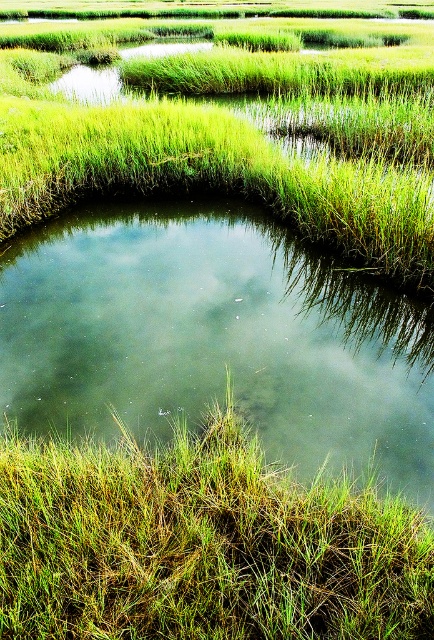
You are standing at the green grassy at lower left and want to reach the green grassy pond at center. Which direction should you move to get there?

You should move to the right to reach the green grassy pond at center from the green grassy at lower left because the green grassy pond at center is located to the right of green grassy at lower left.

You are a drone operator trying to capture aerial footage of the wetland. Your drone is currently at the coordinates given for the green grassy pond at center. To ensure safety, you need to stay above the water. Are you currently positioned over water?

The green grassy pond at center is located at coordinates point (216, 339), so yes, you are positioned over water.

You are standing at the edge of the green grassy pond at center and want to walk to the green grassy at lower left. Which direction should you face to walk directly towards your destination?

You should face downward because the green grassy pond at center is positioned over the green grassy at lower left, meaning the green grassy at lower left is located below the pond.